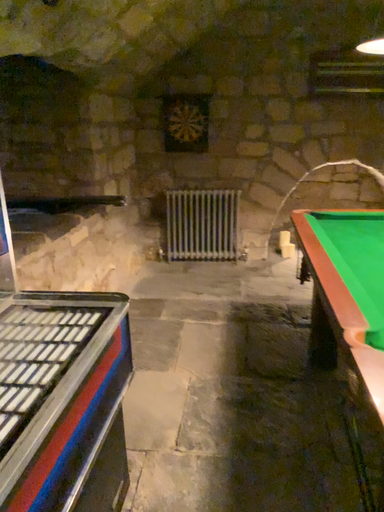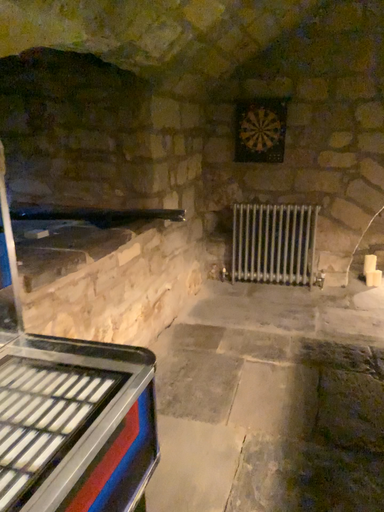
Question: Which way did the camera rotate in the video?

Choices:
 (A) rotated right
 (B) rotated left

Answer: (B)